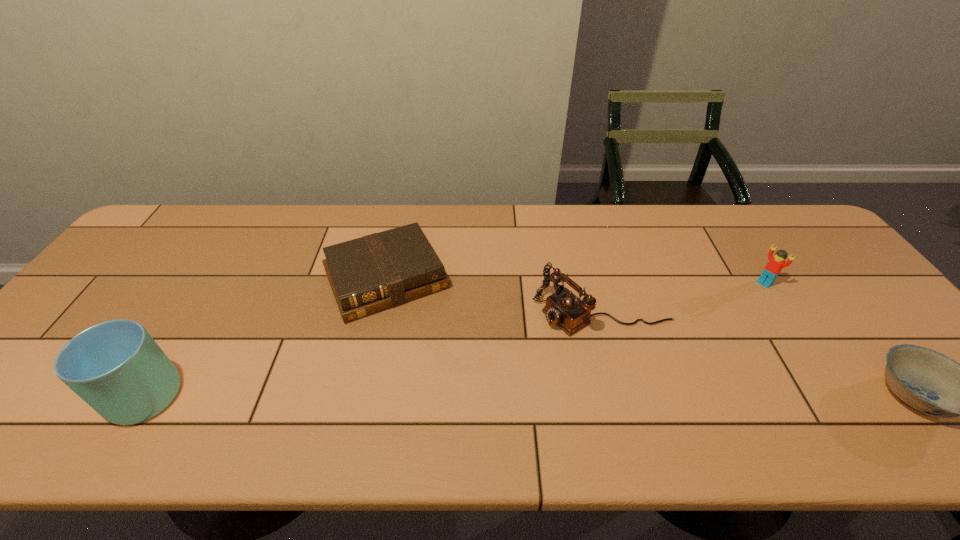
Where is `blank space that satisfies the following two spatial constraints: 1. on the front side of the third object from left to right; 2. on the right side of the Bible`? This screenshot has width=960, height=540. blank space that satisfies the following two spatial constraints: 1. on the front side of the third object from left to right; 2. on the right side of the Bible is located at coordinates (379, 311).

Find the location of `vacant space that satisfies the following two spatial constraints: 1. on the back side of the Lego; 2. on the left side of the mug`. vacant space that satisfies the following two spatial constraints: 1. on the back side of the Lego; 2. on the left side of the mug is located at coordinates (207, 283).